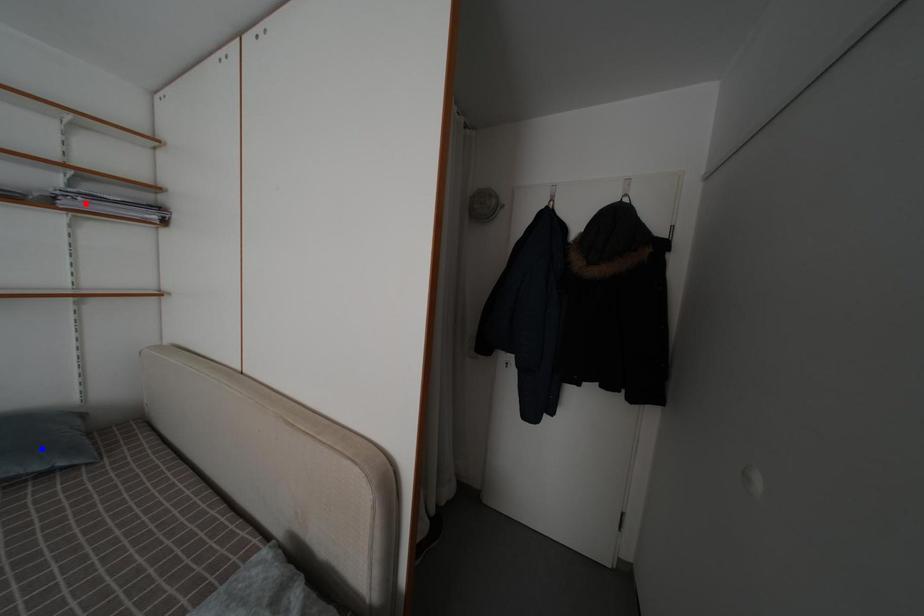
Question: In the image, two points are highlighted. Which point is nearer to the camera? Reply with the corresponding letter.

Choices:
 (A) blue point
 (B) red point

Answer: (A)